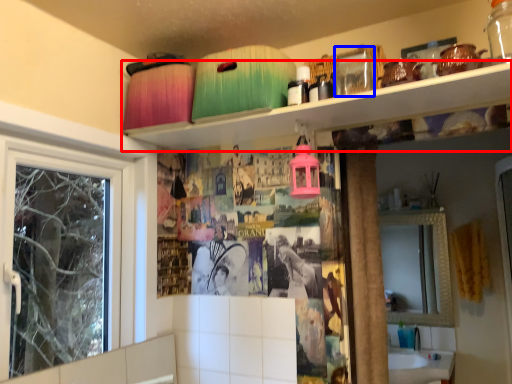
Question: Which object is further to the camera taking this photo, shelf (highlighted by a red box) or glass jar (highlighted by a blue box)?

Choices:
 (A) shelf
 (B) glass jar

Answer: (B)